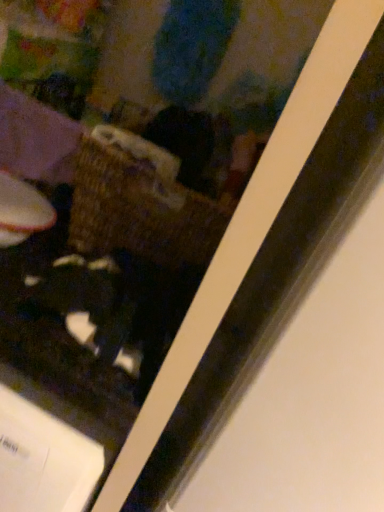
I want to click on brown woven basket at center, so click(x=139, y=203).

Describe the element at coordinates (139, 203) in the screenshot. This screenshot has height=512, width=384. I see `brown woven basket at center` at that location.

In order to face brown woven basket at center, should I rotate leftwards or rightwards?

A 7.319 degree turn to the left will do.

What are the coordinates of `brown woven basket at center` in the screenshot? It's located at (139, 203).